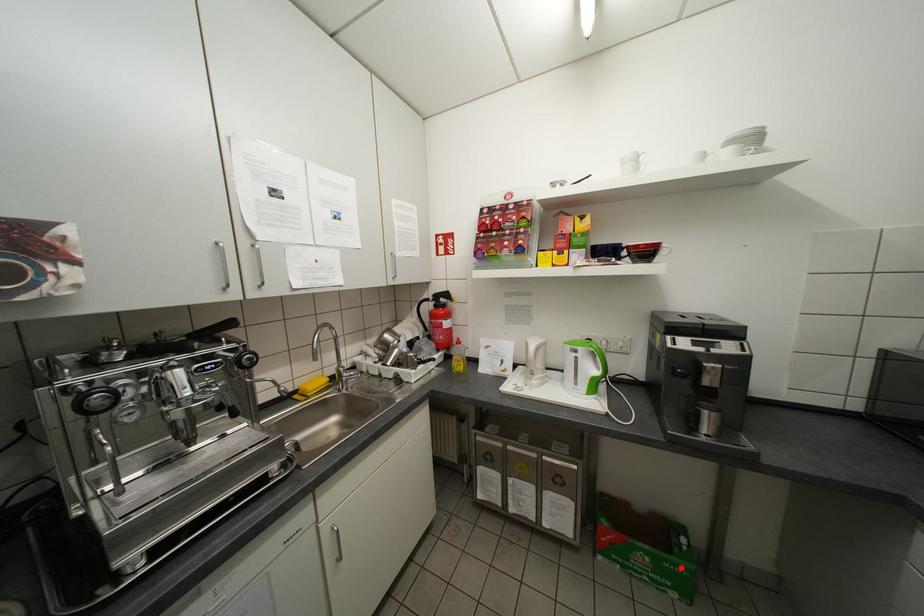
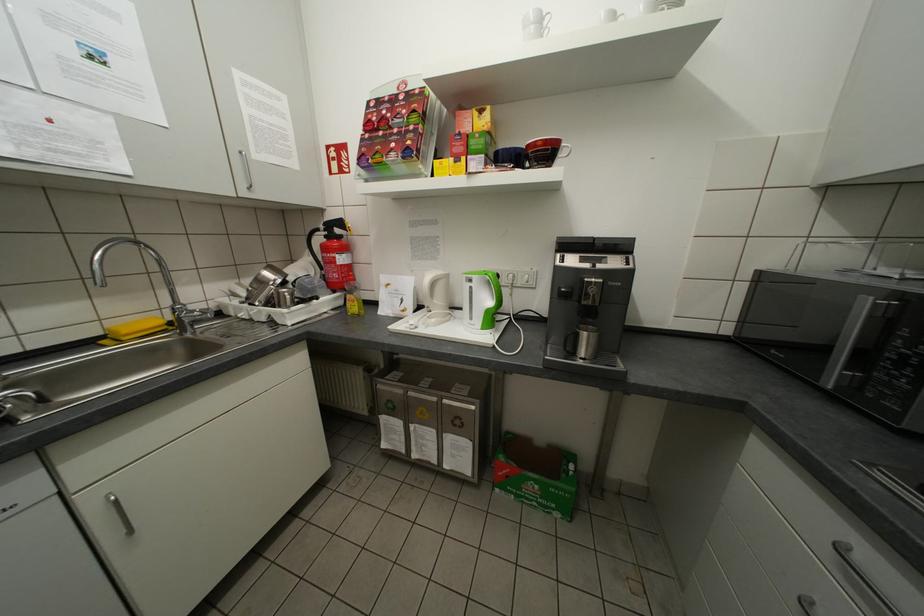
Where in the second image is the point corresponding to the highlighted location from the first image?

(565, 492)